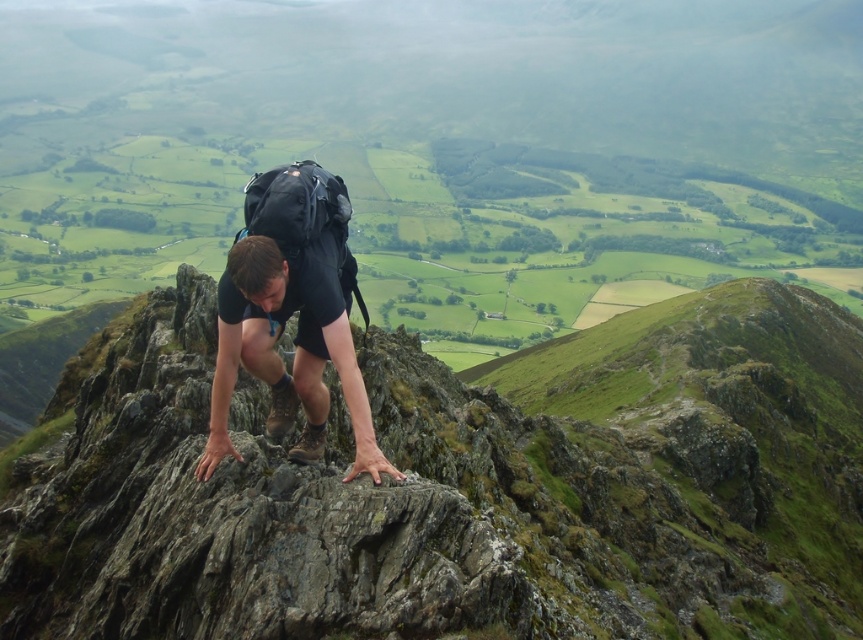
Question: From the image, what is the correct spatial relationship of black matte shorts at center in relation to black fabric backpack at center?

Choices:
 (A) right
 (B) left

Answer: (A)

Question: Is black matte shorts at center to the left of black fabric backpack at center from the viewer's perspective?

Choices:
 (A) yes
 (B) no

Answer: (B)

Question: Among these points, which one is farthest from the camera?

Choices:
 (A) (306, 182)
 (B) (254, 340)

Answer: (B)

Question: Which object appears farthest from the camera in this image?

Choices:
 (A) black fabric backpack at center
 (B) black matte shorts at center

Answer: (A)

Question: Is black matte shorts at center below black fabric backpack at center?

Choices:
 (A) yes
 (B) no

Answer: (A)